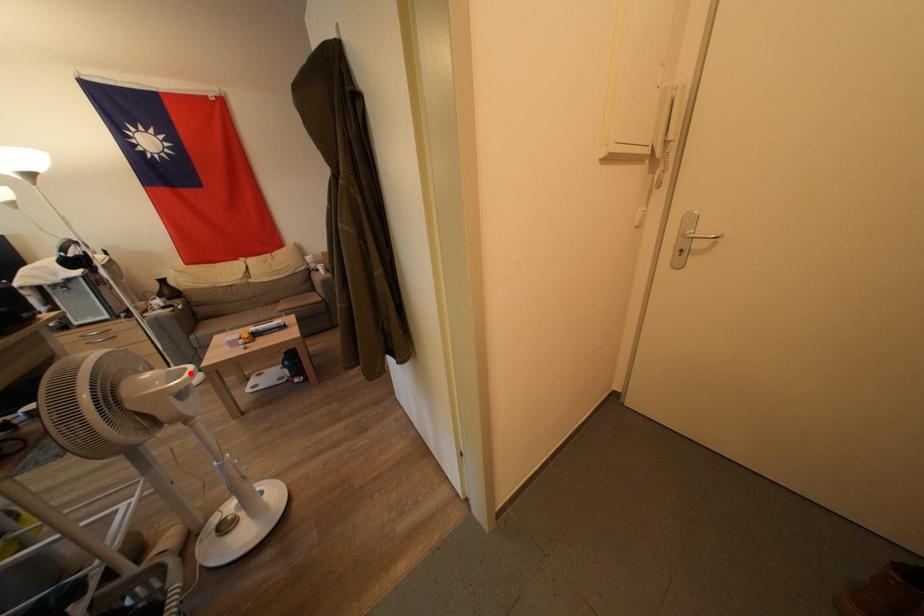
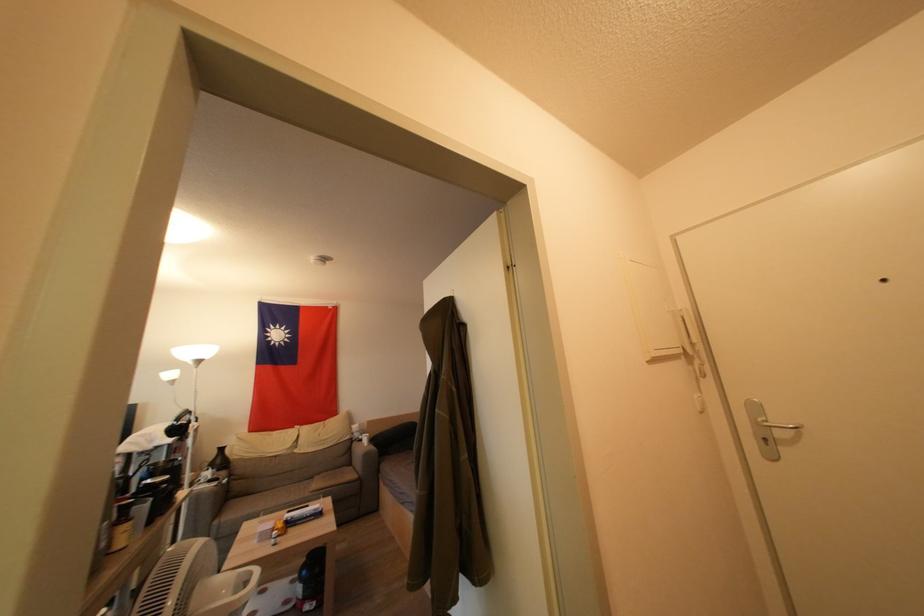
Find the pixel in the second image that matches the highlighted location in the first image.

(256, 577)